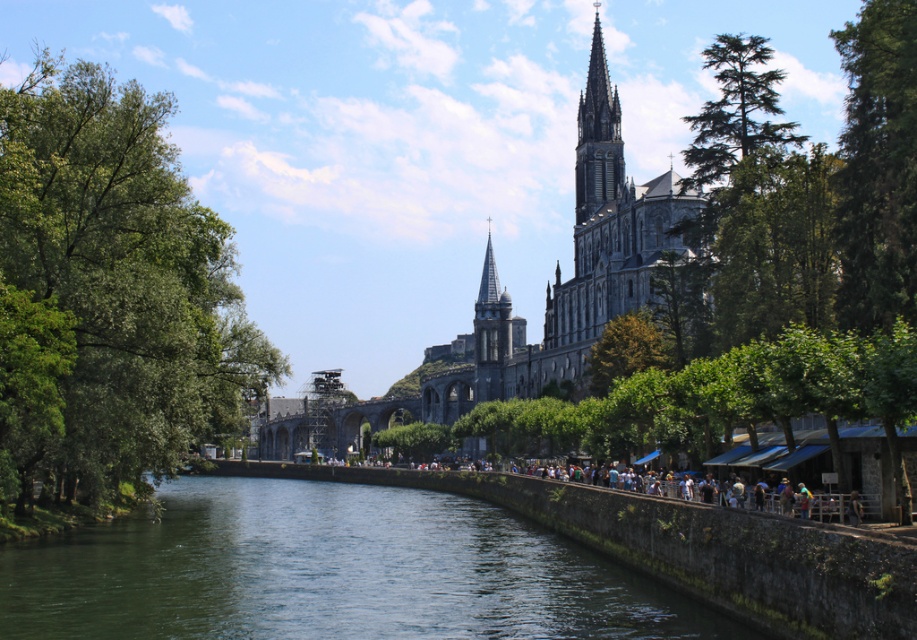
You are an architect visiting the riverside cathedral. You notice the green leafy tree at left and the greenish water at center. Which object would cast a larger shadow on the ground?

The green leafy tree at left has a larger size compared to the greenish water at center, so it would cast a larger shadow on the ground.

You are standing at the edge of the river and want to take a photo of the cathedral. Where should you position yourself to ensure the greenish water at center is in the frame?

To include the greenish water at center in your photo, position yourself at the edge of the river near the point with coordinates approximately 0.894 on the x axis and 0.361 on the y axis, as that is where the greenish water at center is located.